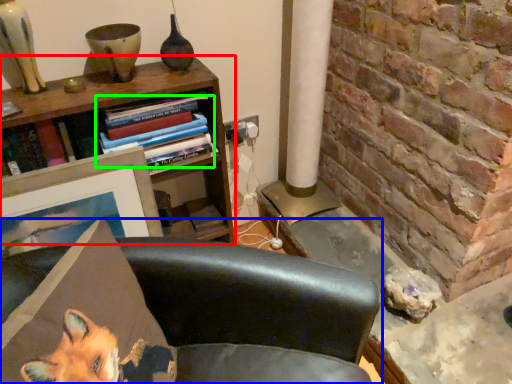
Question: Considering the real-world distances, which object is closest to bookcase (highlighted by a red box)? chair (highlighted by a blue box) or book (highlighted by a green box).

Choices:
 (A) chair
 (B) book

Answer: (B)